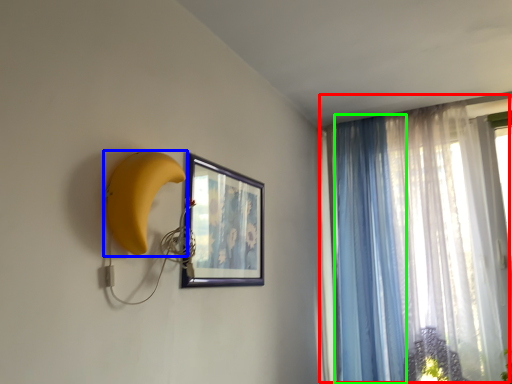
Question: Which object is the farthest from curtain (highlighted by a red box)? Choose among these: banana (highlighted by a blue box) or curtain (highlighted by a green box).

Choices:
 (A) banana
 (B) curtain

Answer: (A)